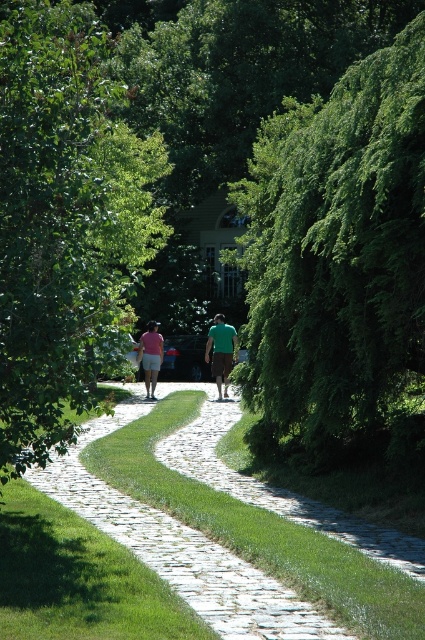
You are standing at the starting point of the cobblestone path and want to walk towards the green leafy tree at center. Which direction should you head?

To reach the green leafy tree at center, you should head towards the direction indicated by its 2D coordinates at point (339, 268).

You are a gardener planning to trim the branches of both the green leafy tree at center and the green leafy tree at left. Based on their sizes, which tree might require more time and effort to trim?

The green leafy tree at left might require more time and effort to trim since it is thicker than the green leafy tree at center.

You are a gardener planning to trim the trees along the path. Which tree, the green leafy tree at center or the green leafy tree at left, requires more pruning to maintain its size relative to the other?

The green leafy tree at left requires more pruning since it is larger than the green leafy tree at center, as stated in the description.